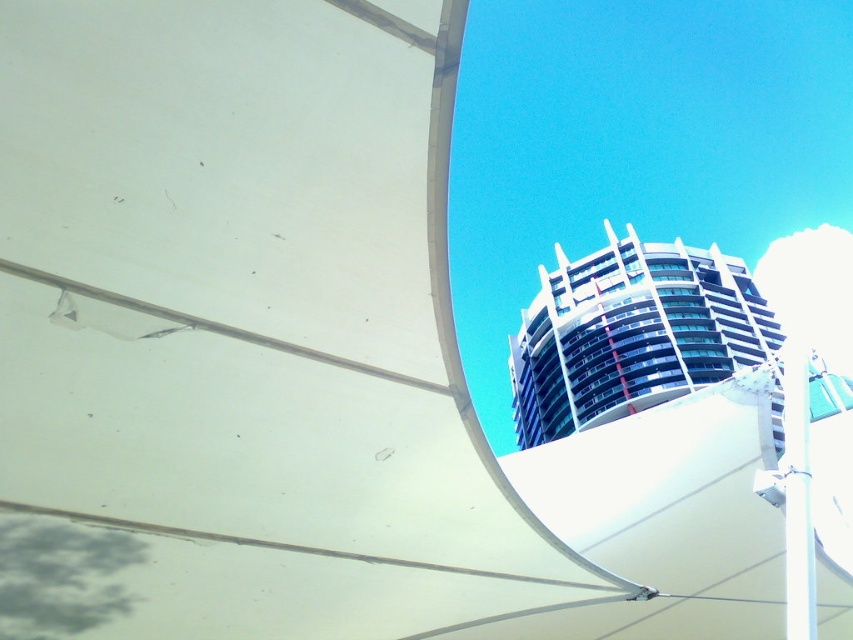
Is white glass building at upper center shorter than white glossy pole at right?

Incorrect, white glass building at upper center's height does not fall short of white glossy pole at right's.

Is white glass building at upper center behind white glossy pole at right?

Yes, white glass building at upper center is behind white glossy pole at right.

This screenshot has height=640, width=853. What do you see at coordinates (631, 333) in the screenshot?
I see `white glass building at upper center` at bounding box center [631, 333].

Identify the location of white glass building at upper center. (631, 333).